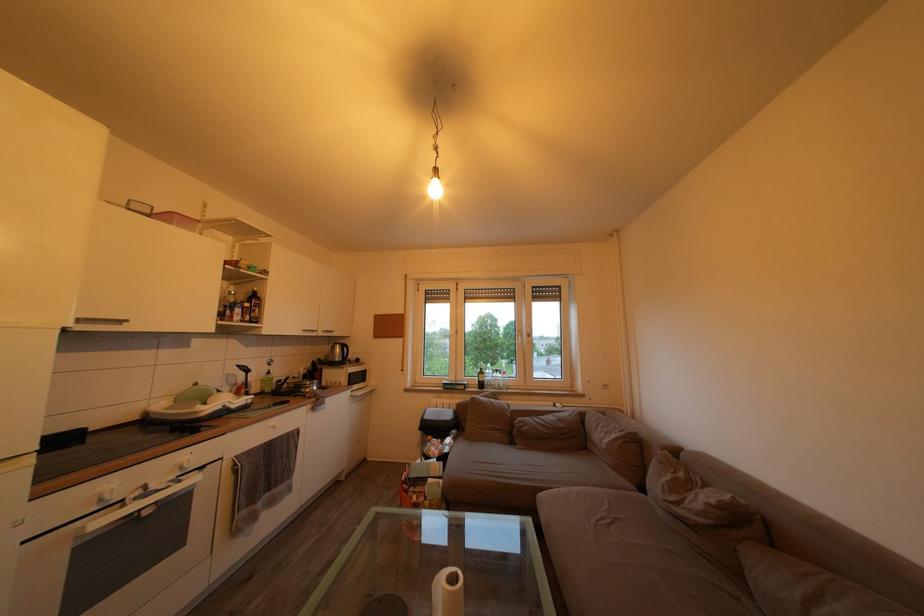
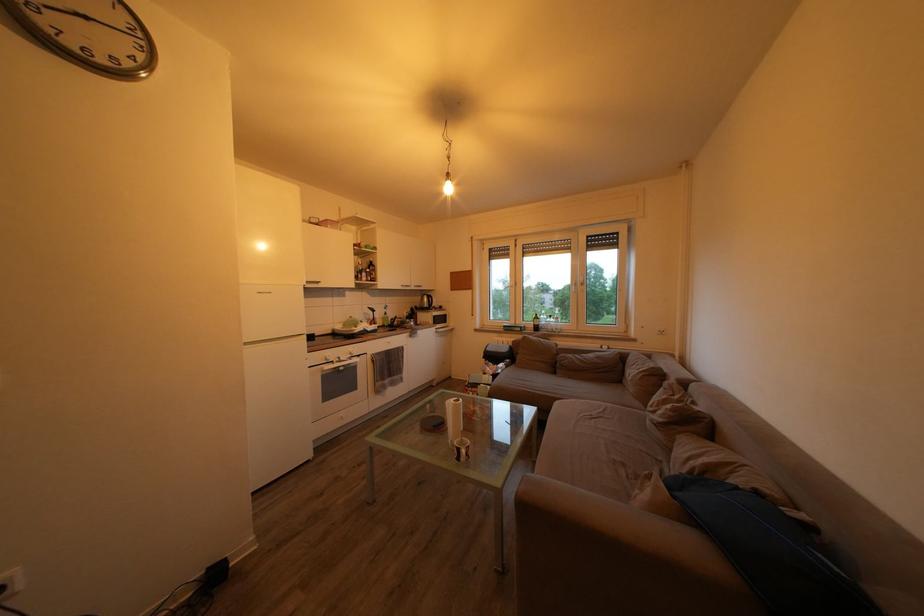
In the second image, find the point that corresponds to (x=367, y=384) in the first image.

(448, 326)